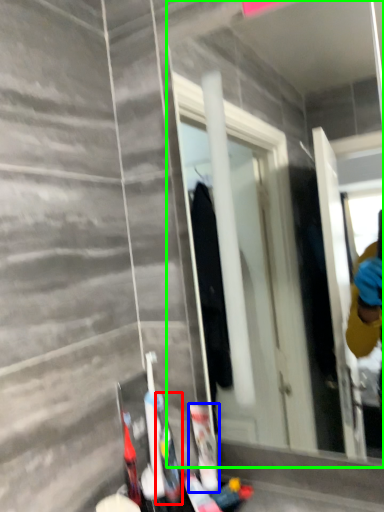
Question: Based on their relative distances, which object is nearer to toiletry (highlighted by a red box)? Choose from toiletry (highlighted by a blue box) and mirror (highlighted by a green box).

Choices:
 (A) toiletry
 (B) mirror

Answer: (A)